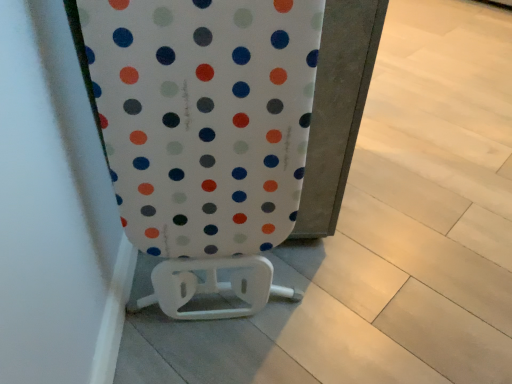
Question: Should I look upward or downward to see white plastic toilet at center?

Choices:
 (A) up
 (B) down

Answer: (A)